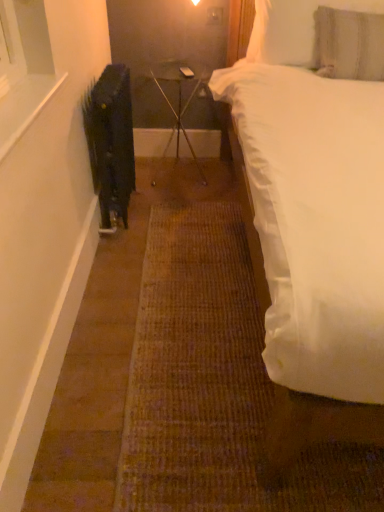
Question: Is white soft pillow at upper right, placed as the 1th pillow when sorted from top to bottom, thinner than black matte radiator at left?

Choices:
 (A) no
 (B) yes

Answer: (B)

Question: Is black matte radiator at left at the back of white soft pillow at upper right, placed as the 1th pillow when sorted from top to bottom?

Choices:
 (A) no
 (B) yes

Answer: (A)

Question: Considering the relative sizes of white soft pillow at upper right, the 2th pillow positioned from the bottom, and black matte radiator at left in the image provided, is white soft pillow at upper right, the 2th pillow positioned from the bottom, bigger than black matte radiator at left?

Choices:
 (A) no
 (B) yes

Answer: (A)

Question: From the image's perspective, is white soft pillow at upper right, placed as the 1th pillow when sorted from top to bottom, on black matte radiator at left?

Choices:
 (A) no
 (B) yes

Answer: (B)

Question: Does white soft pillow at upper right, the 2th pillow positioned from the bottom, have a greater width compared to black matte radiator at left?

Choices:
 (A) yes
 (B) no

Answer: (B)

Question: Is black matte radiator at left in front of or behind clear glass table at center in the image?

Choices:
 (A) behind
 (B) front

Answer: (B)

Question: Considering the positions of black matte radiator at left and clear glass table at center in the image, is black matte radiator at left taller or shorter than clear glass table at center?

Choices:
 (A) tall
 (B) short

Answer: (A)

Question: Is black matte radiator at left to the left or to the right of clear glass table at center in the image?

Choices:
 (A) left
 (B) right

Answer: (A)

Question: From a real-world perspective, is black matte radiator at left physically located above or below clear glass table at center?

Choices:
 (A) above
 (B) below

Answer: (A)

Question: Based on their positions, is clear glass table at center located to the left or right of white soft bed at right?

Choices:
 (A) right
 (B) left

Answer: (B)

Question: Considering the positions of clear glass table at center and white soft bed at right in the image, is clear glass table at center taller or shorter than white soft bed at right?

Choices:
 (A) short
 (B) tall

Answer: (A)

Question: Would you say clear glass table at center is inside or outside white soft bed at right?

Choices:
 (A) inside
 (B) outside

Answer: (B)

Question: From the image's perspective, is clear glass table at center above or below white soft bed at right?

Choices:
 (A) below
 (B) above

Answer: (B)

Question: Considering the positions of white soft pillow at upper right, placed as the 1th pillow when sorted from top to bottom, and textured gray pillow at upper right, which is the first pillow in bottom-to-top order, in the image, is white soft pillow at upper right, placed as the 1th pillow when sorted from top to bottom, taller or shorter than textured gray pillow at upper right, which is the first pillow in bottom-to-top order,?

Choices:
 (A) tall
 (B) short

Answer: (B)

Question: Is white soft pillow at upper right, the 2th pillow positioned from the bottom, bigger or smaller than textured gray pillow at upper right, the 2th pillow when ordered from top to bottom?

Choices:
 (A) big
 (B) small

Answer: (B)